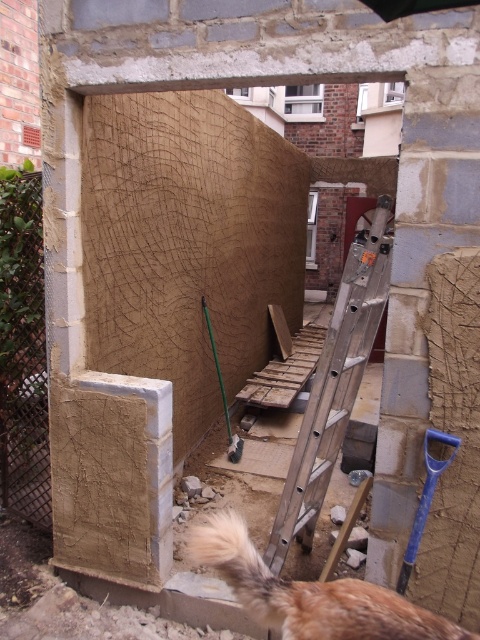
You are a construction worker who needs to reach the top of the wall to continue applying the textured finish. You have a silver metallic ladder at center and a green plastic shovel at center. Which tool should you use to safely climb up?

You should use the silver metallic ladder at center because it is closer to the viewer, making it more accessible for climbing up to the wall.

You are a worker who needs to carry both the silver metallic ladder at center and the blue plastic shovel at lower right to a storage area. If the storage area has a narrow doorway that only allows items up to 1 meter in width, which item might you need to disassemble first?

The silver metallic ladder at center might need to be disassembled first because it is wider than the blue plastic shovel at lower right, so it may not fit through the narrow doorway.

You are a worker at the construction site. You need to reach the top of the silver metallic ladder at center to continue working. Is the blue plastic shovel at lower right in a position that might obstruct your path when climbing the ladder?

The silver metallic ladder at center is above the blue plastic shovel at lower right, so the shovel is positioned below the ladder. This means the shovel is not in a position to obstruct your path when climbing the ladder.